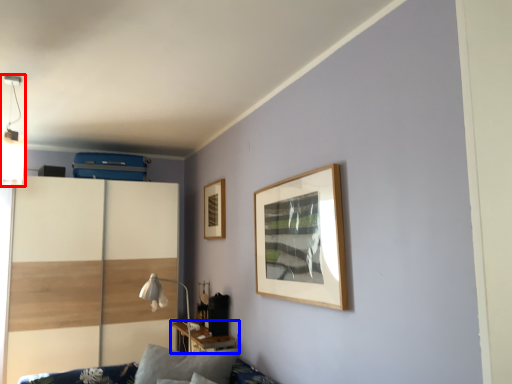
Question: Which object appears farthest to the camera in this image, light fixture (highlighted by a red box) or table (highlighted by a blue box)?

Choices:
 (A) light fixture
 (B) table

Answer: (B)